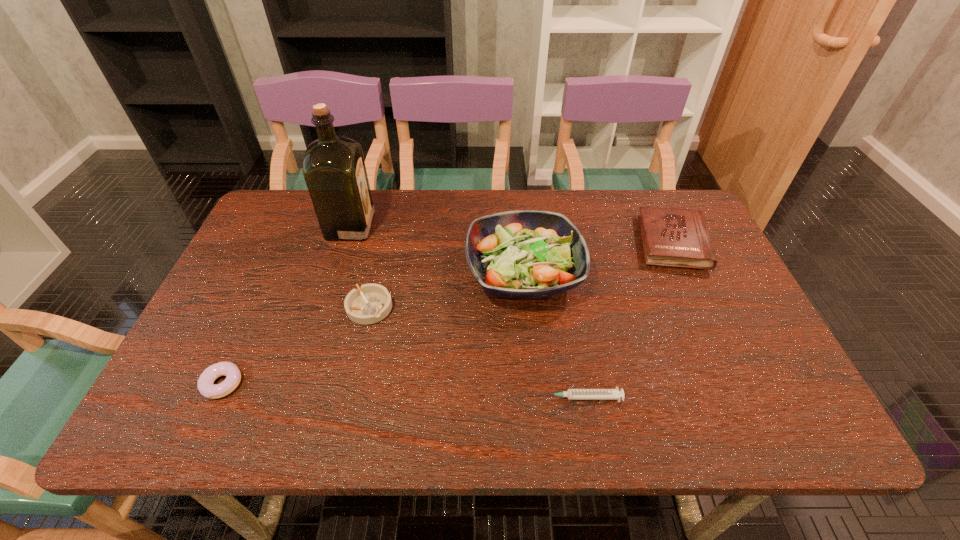
You are a GUI agent. You are given a task and a screenshot of the screen. Output one action in this format:
    pyautogui.click(x=<x>, y=<y>)
    Task: Click on the vacant region located on the left of the ashtray
    This screenshot has width=960, height=540.
    Given the screenshot: What is the action you would take?
    pyautogui.click(x=300, y=308)

Find the location of `free space located 0.190m on the right of the doughnut`. free space located 0.190m on the right of the doughnut is located at coordinates (329, 384).

Where is `free space located 0.060m at the needle end of the shortest object`? The image size is (960, 540). free space located 0.060m at the needle end of the shortest object is located at coordinates (512, 397).

What are the coordinates of `vacant region located at the needle end of the shortest object` in the screenshot? It's located at (371, 397).

The width and height of the screenshot is (960, 540). What are the coordinates of `blank space located at the needle end of the shortest object` in the screenshot? It's located at (455, 397).

This screenshot has height=540, width=960. What are the coordinates of `liquor at the far edge` in the screenshot? It's located at (334, 170).

This screenshot has width=960, height=540. In order to click on salad plate present at the far edge in this screenshot , I will do `click(522, 254)`.

In order to click on hardback book that is positioned at the far edge in this screenshot , I will do `click(675, 237)`.

Locate an element on the screen. This screenshot has height=540, width=960. doughnut that is at the near edge is located at coordinates (205, 385).

Locate an element on the screen. The width and height of the screenshot is (960, 540). syringe at the near edge is located at coordinates (572, 394).